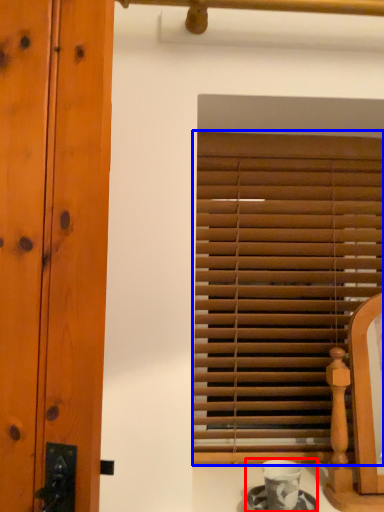
Question: Which of the following is the closest to the observer, tea set (highlighted by a red box) or window blind (highlighted by a blue box)?

Choices:
 (A) tea set
 (B) window blind

Answer: (A)